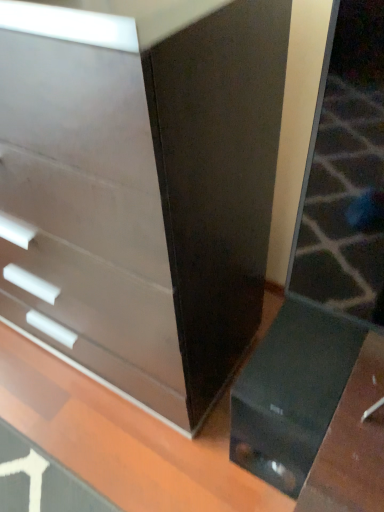
Question: Are glossy black table at lower right and matte white chest of drawers at left far apart?

Choices:
 (A) yes
 (B) no

Answer: (B)

Question: Is glossy black table at lower right turned away from matte white chest of drawers at left?

Choices:
 (A) no
 (B) yes

Answer: (A)

Question: Is glossy black table at lower right surrounding matte white chest of drawers at left?

Choices:
 (A) yes
 (B) no

Answer: (B)

Question: Is glossy black table at lower right taller than matte white chest of drawers at left?

Choices:
 (A) yes
 (B) no

Answer: (B)

Question: Is glossy black table at lower right oriented towards matte white chest of drawers at left?

Choices:
 (A) yes
 (B) no

Answer: (B)

Question: Can you confirm if glossy black table at lower right is bigger than matte white chest of drawers at left?

Choices:
 (A) yes
 (B) no

Answer: (B)

Question: From the image's perspective, does matte white chest of drawers at left appear higher than glossy black table at lower right?

Choices:
 (A) no
 (B) yes

Answer: (B)

Question: Does matte white chest of drawers at left have a greater height compared to glossy black table at lower right?

Choices:
 (A) yes
 (B) no

Answer: (A)

Question: Is matte white chest of drawers at left at the right side of glossy black table at lower right?

Choices:
 (A) yes
 (B) no

Answer: (B)

Question: Is matte white chest of drawers at left bigger than glossy black table at lower right?

Choices:
 (A) no
 (B) yes

Answer: (B)

Question: Are matte white chest of drawers at left and glossy black table at lower right far apart?

Choices:
 (A) no
 (B) yes

Answer: (A)

Question: Is matte white chest of drawers at left positioned beyond the bounds of glossy black table at lower right?

Choices:
 (A) yes
 (B) no

Answer: (A)

Question: In terms of size, does matte white chest of drawers at left appear bigger or smaller than glossy black table at lower right?

Choices:
 (A) small
 (B) big

Answer: (B)